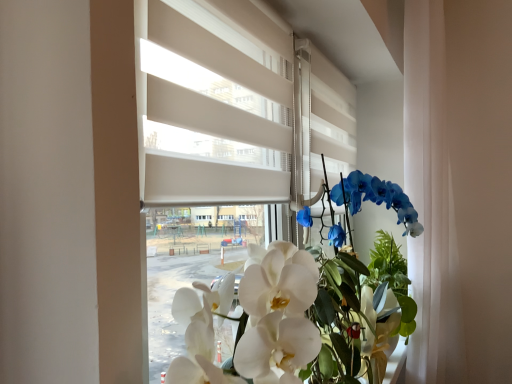
Question: Is white sheer curtain at right outside white matte blinds at center?

Choices:
 (A) no
 (B) yes

Answer: (B)

Question: Can you confirm if white sheer curtain at right is smaller than white matte blinds at center?

Choices:
 (A) no
 (B) yes

Answer: (A)

Question: From the image's perspective, is white sheer curtain at right below white matte blinds at center?

Choices:
 (A) no
 (B) yes

Answer: (B)

Question: Is white sheer curtain at right positioned before white matte blinds at center?

Choices:
 (A) yes
 (B) no

Answer: (B)

Question: Can you confirm if white sheer curtain at right is bigger than white matte blinds at center?

Choices:
 (A) no
 (B) yes

Answer: (B)

Question: Is white sheer curtain at right far from white matte blinds at center?

Choices:
 (A) no
 (B) yes

Answer: (A)

Question: Is white matte blinds at center thinner than white sheer curtain at right?

Choices:
 (A) no
 (B) yes

Answer: (B)

Question: Can white sheer curtain at right be found inside white matte blinds at center?

Choices:
 (A) yes
 (B) no

Answer: (B)

Question: Is the depth of white matte blinds at center less than that of white sheer curtain at right?

Choices:
 (A) no
 (B) yes

Answer: (B)

Question: From a real-world perspective, is white matte blinds at center located higher than white sheer curtain at right?

Choices:
 (A) yes
 (B) no

Answer: (A)

Question: Is white matte blinds at center not within white sheer curtain at right?

Choices:
 (A) no
 (B) yes

Answer: (B)

Question: Is white matte blinds at center shorter than white sheer curtain at right?

Choices:
 (A) yes
 (B) no

Answer: (A)

Question: Considering the relative sizes of white glossy orchid at center and white matte blinds at center in the image provided, is white glossy orchid at center wider than white matte blinds at center?

Choices:
 (A) no
 (B) yes

Answer: (B)